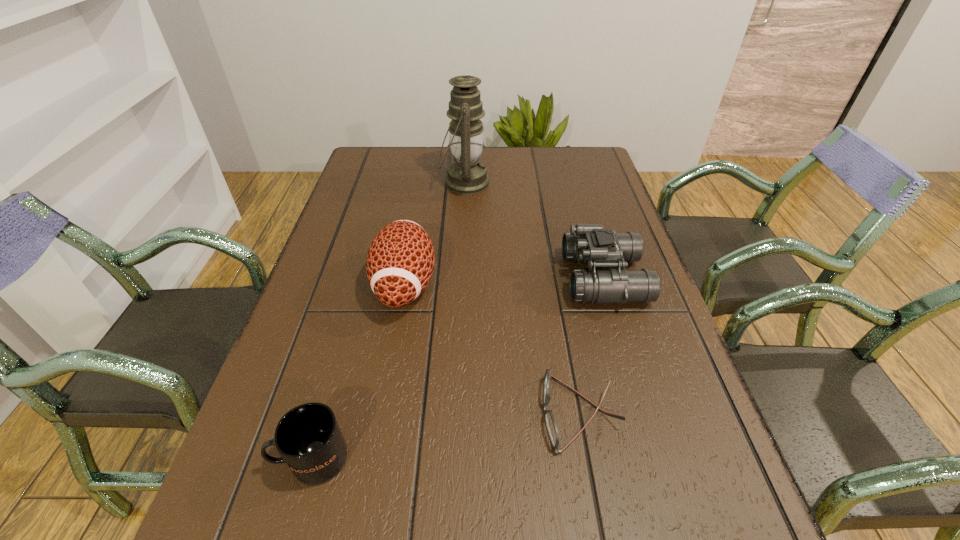
This screenshot has width=960, height=540. What are the coordinates of `free space located through the lenses of the binoculars` in the screenshot? It's located at (545, 278).

Where is `free point located on the front-facing side of the spectacles`? The height and width of the screenshot is (540, 960). free point located on the front-facing side of the spectacles is located at coordinates (328, 413).

The width and height of the screenshot is (960, 540). I want to click on vacant region located on the front-facing side of the spectacles, so click(471, 413).

In order to click on free space located 0.330m on the front-facing side of the spectacles in this screenshot , I will do `click(361, 413)`.

This screenshot has width=960, height=540. I want to click on object situated at the far edge, so click(x=467, y=175).

Locate an element on the screen. The height and width of the screenshot is (540, 960). football at the left edge is located at coordinates (400, 261).

At what (x,y) coordinates should I click in order to perform the action: click on mug that is at the left edge. Please return your answer as a coordinate pair (x, y). This screenshot has height=540, width=960. Looking at the image, I should click on (x=308, y=437).

Locate an element on the screen. binoculars present at the right edge is located at coordinates (589, 243).

Locate an element on the screen. Image resolution: width=960 pixels, height=540 pixels. spectacles located at the right edge is located at coordinates (552, 429).

Locate an element on the screen. free space at the far edge of the desktop is located at coordinates (407, 174).